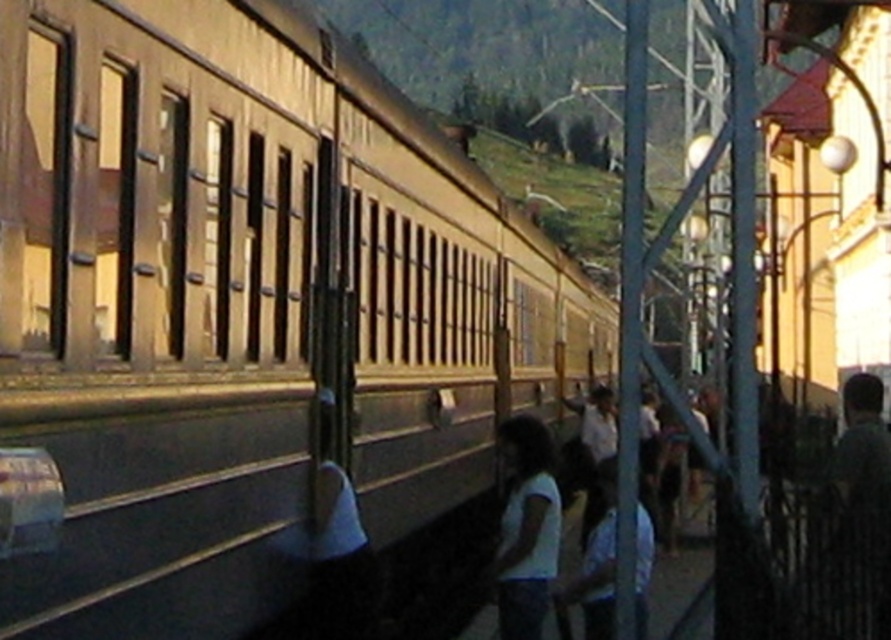
Question: Which is nearer to the white fabric shirt at center?

Choices:
 (A) dark green shirt at right
 (B) white fabric at center
 (C) white matte shirt at lower center

Answer: (C)

Question: Does metallic gold train at center have a larger size compared to white fabric shirt at center?

Choices:
 (A) yes
 (B) no

Answer: (A)

Question: Which object is closer to the camera taking this photo?

Choices:
 (A) white fabric at center
 (B) white fabric shirt at center
 (C) metallic gold train at center

Answer: (C)

Question: Which point is closer to the camera?

Choices:
 (A) tap(527, 435)
 (B) tap(847, 490)
 (C) tap(340, 595)

Answer: (A)

Question: Considering the relative positions of metallic gold train at center and white matte shirt at lower center in the image provided, where is metallic gold train at center located with respect to white matte shirt at lower center?

Choices:
 (A) right
 (B) left

Answer: (A)

Question: In this image, where is metallic gold train at center located relative to white fabric shirt at center?

Choices:
 (A) above
 (B) below

Answer: (A)